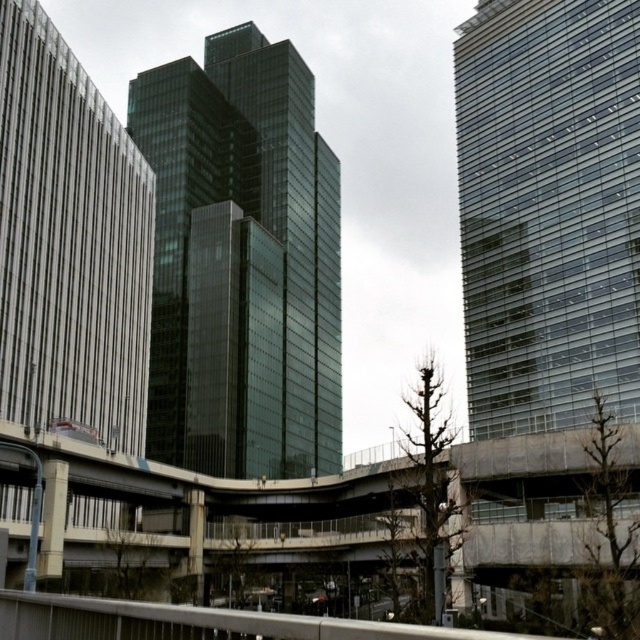
You are a drone operator trying to navigate between two skyscrapers in the city. You need to fly your drone from the glassy black skyscraper at center to the transparent glass tower at right. According to the scene, which direction should you fly the drone to reach the destination?

The glassy black skyscraper at center is positioned on the left side of transparent glass tower at right, so you should fly the drone to the right to reach the transparent glass tower at right.

You are a city planner analyzing the urban layout. Based on the image, which of the two structures, the glassy black skyscraper at center or the transparent glass tower at right, occupies a larger footprint in the city? Explain your reasoning using the scene details.

The glassy black skyscraper at center is bigger than the transparent glass tower at right, so it occupies a larger footprint in the city.